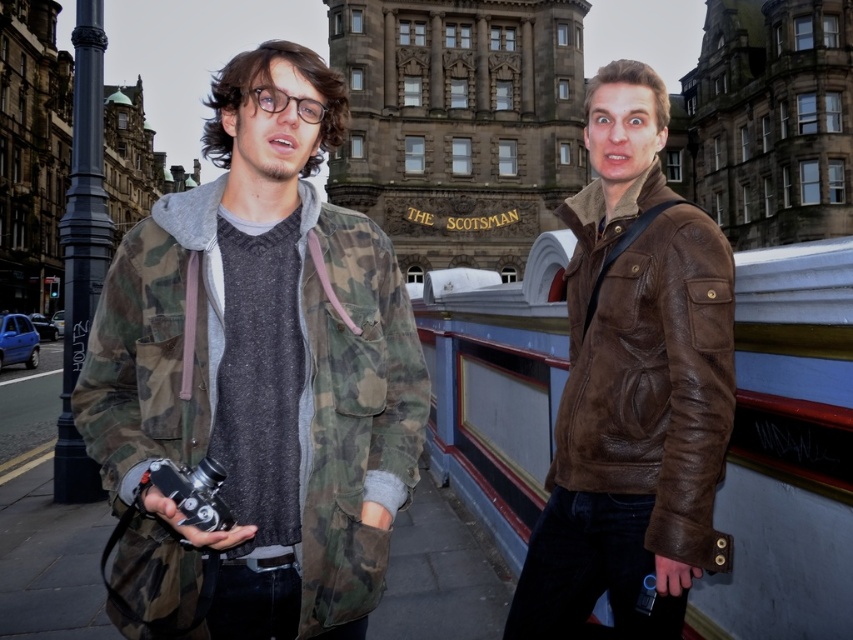
Question: Is brown leather jacket at right further to camera compared to matte black camera at lower left?

Choices:
 (A) yes
 (B) no

Answer: (B)

Question: Does brown leather jacket at right appear over matte black camera at lower left?

Choices:
 (A) yes
 (B) no

Answer: (A)

Question: Estimate the real-world distances between objects in this image. Which object is farther from the matte black camera at lower left?

Choices:
 (A) brown leather jacket at right
 (B) camo jacket at center

Answer: (A)

Question: Which point is farther from the camera taking this photo?

Choices:
 (A) (631, 490)
 (B) (210, 474)
 (C) (206, 192)

Answer: (C)

Question: Considering the real-world distances, which object is farthest from the brown leather jacket at right?

Choices:
 (A) camo jacket at center
 (B) matte black camera at lower left

Answer: (B)

Question: Can you confirm if camo jacket at center is thinner than brown leather jacket at right?

Choices:
 (A) yes
 (B) no

Answer: (B)